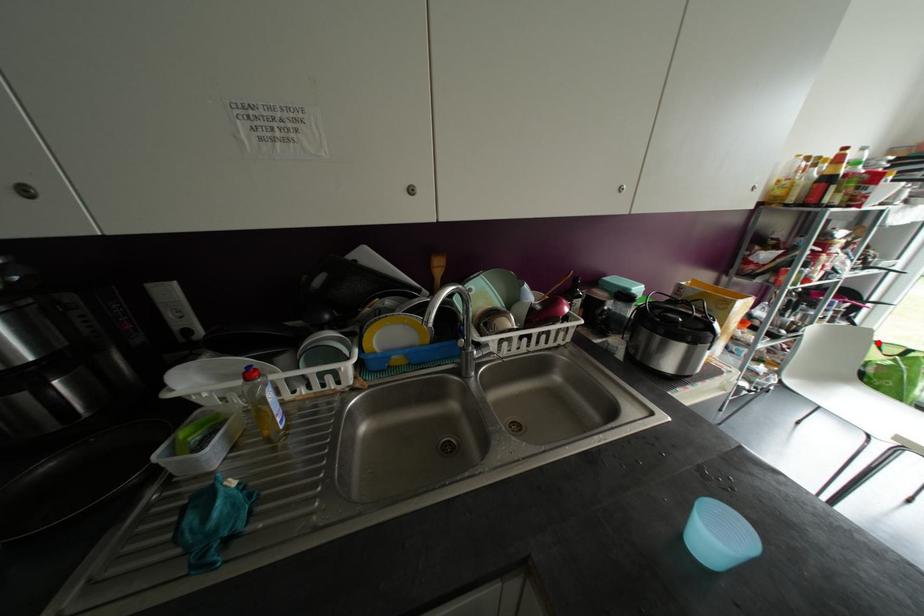
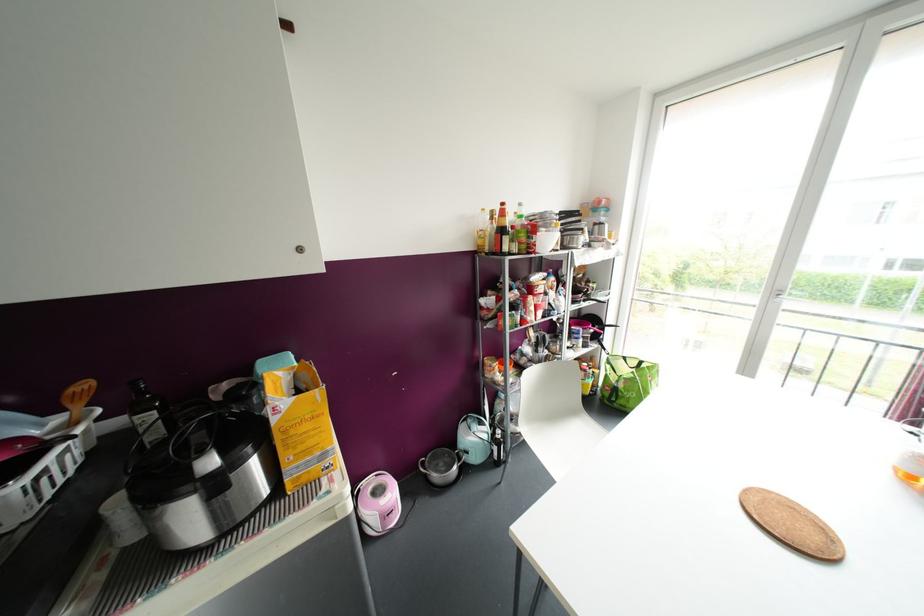
Question: I am providing you with two images of the same scene from different viewpoints. A red point is marked on the first image. At the location where the point appears in image 1, is it still visible in image 2?

Choices:
 (A) Yes
 (B) No

Answer: (A)